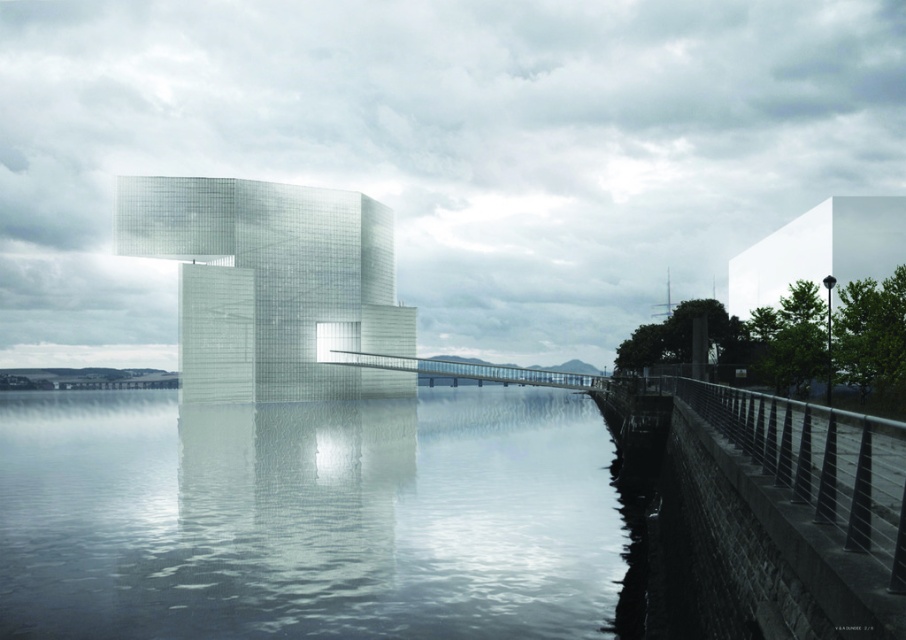
Question: Which object is closer to the camera taking this photo?

Choices:
 (A) transparent glass water at lower center
 (B) transparent glass bridge at center

Answer: (A)

Question: Which object appears closest to the camera in this image?

Choices:
 (A) transparent glass bridge at center
 (B) transparent glass water at lower center

Answer: (B)

Question: Is transparent glass water at lower center to the right of transparent glass bridge at center from the viewer's perspective?

Choices:
 (A) no
 (B) yes

Answer: (A)

Question: Is transparent glass water at lower center thinner than transparent glass bridge at center?

Choices:
 (A) yes
 (B) no

Answer: (B)

Question: Can you confirm if transparent glass water at lower center is positioned to the left of transparent glass bridge at center?

Choices:
 (A) yes
 (B) no

Answer: (A)